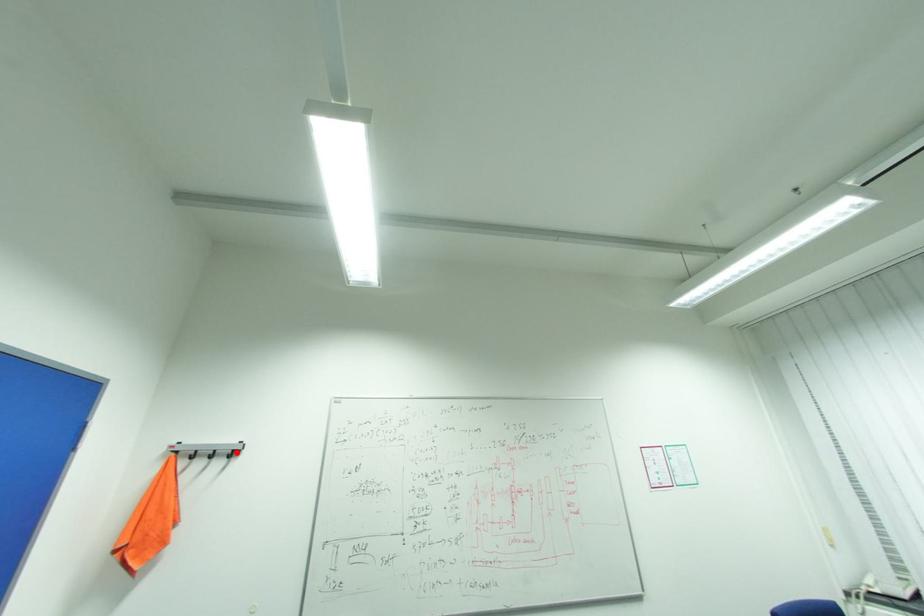
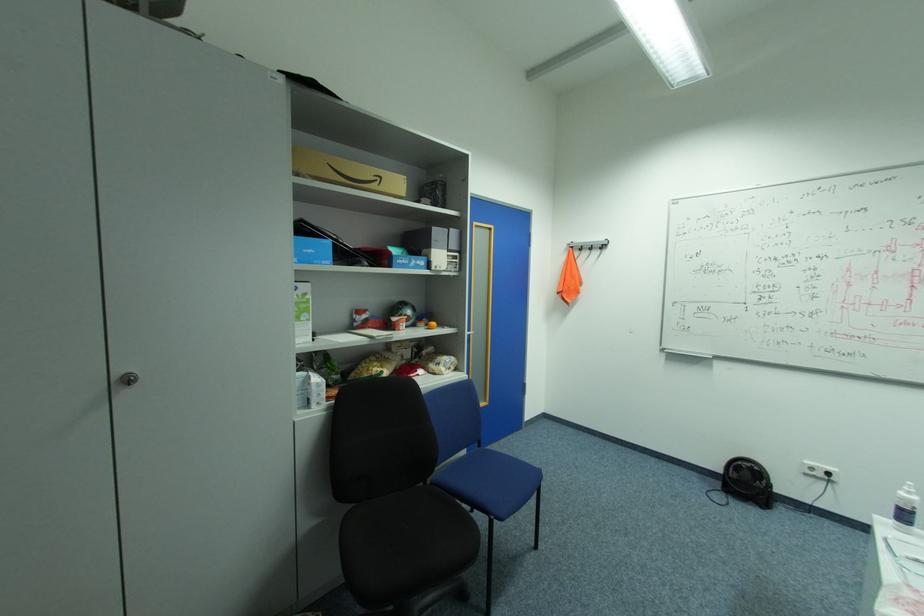
Locate, in the second image, the point that corresponds to the highlighted location in the first image.

(608, 246)